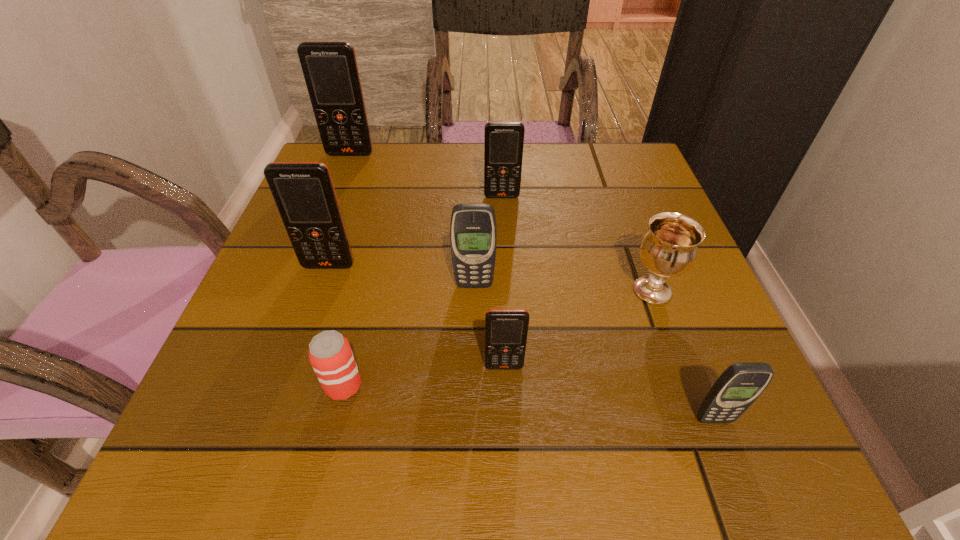
This screenshot has width=960, height=540. Identify the location of vacant area at the right edge. (686, 364).

Identify the location of free space at the far left corner. This screenshot has height=540, width=960. (372, 157).

You are a GUI agent. You are given a task and a screenshot of the screen. Output one action in this format:
    pyautogui.click(x=<x>, y=<y>)
    Task: Click on the vacant space at the far right corner of the desktop
    
    Given the screenshot: What is the action you would take?
    pyautogui.click(x=634, y=168)

What are the coordinates of `vacant region at the near right corner of the desktop` in the screenshot? It's located at (688, 441).

The height and width of the screenshot is (540, 960). In order to click on blank region between the chalice and the third nearest cellular telephone in this screenshot , I will do `click(564, 288)`.

The height and width of the screenshot is (540, 960). In order to click on vacant space in between the nearest cellular telephone and the sixth object from right to left in this screenshot , I will do `click(529, 402)`.

The image size is (960, 540). Find the location of `vacant area between the fifth nearest cellular telephone and the nearer gray cellular telephone`. vacant area between the fifth nearest cellular telephone and the nearer gray cellular telephone is located at coordinates (608, 308).

I want to click on empty space between the bigger gray cellular telephone and the third farthest orange cellular telephone, so click(401, 275).

What are the coordinates of `free space between the third nearest orange cellular telephone and the second tallest cellular telephone` in the screenshot? It's located at click(416, 231).

Locate an element on the screen. The image size is (960, 540). free space between the second nearest cellular telephone and the second nearest orange cellular telephone is located at coordinates (417, 316).